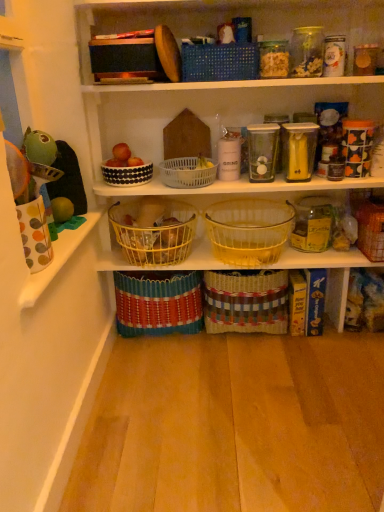
Question: From a real-world perspective, does white plastic basket at center, the 6th basket positioned from the bottom, stand above translucent glass basket at center, marked as the fourth basket in a top-to-bottom arrangement?

Choices:
 (A) yes
 (B) no

Answer: (A)

Question: Is white plastic basket at center, the 6th basket positioned from the bottom, closer to the viewer compared to translucent glass basket at center, which is counted as the fifth basket, starting from the bottom?

Choices:
 (A) yes
 (B) no

Answer: (B)

Question: Is translucent glass basket at center, marked as the fourth basket in a top-to-bottom arrangement, inside white plastic basket at center, the third basket from the top?

Choices:
 (A) yes
 (B) no

Answer: (B)

Question: Does white plastic basket at center, the third basket from the top, have a lesser height compared to translucent glass basket at center, which is counted as the fifth basket, starting from the bottom?

Choices:
 (A) yes
 (B) no

Answer: (A)

Question: Is translucent glass basket at center, marked as the fourth basket in a top-to-bottom arrangement, at the back of white plastic basket at center, the third basket from the top?

Choices:
 (A) yes
 (B) no

Answer: (B)

Question: From a real-world perspective, is translucent glass basket at center, marked as the fourth basket in a top-to-bottom arrangement, physically located above or below woven brown basket at lower right, placed as the 4th basket when sorted from bottom to top?

Choices:
 (A) below
 (B) above

Answer: (B)

Question: Looking at the image, does translucent glass basket at center, marked as the fourth basket in a top-to-bottom arrangement, seem bigger or smaller compared to woven brown basket at lower right, placed as the 4th basket when sorted from bottom to top?

Choices:
 (A) big
 (B) small

Answer: (A)

Question: From the image's perspective, is translucent glass basket at center, which is counted as the fifth basket, starting from the bottom, located above or below woven brown basket at lower right, placed as the 4th basket when sorted from bottom to top?

Choices:
 (A) below
 (B) above

Answer: (B)

Question: Does point (281, 221) appear closer or farther from the camera than point (375, 262)?

Choices:
 (A) farther
 (B) closer

Answer: (A)

Question: From the image's perspective, is woven brown basket at lower right, placed as the 4th basket when sorted from bottom to top, above or below woven fabric basket at center, positioned as the 8th basket in top-to-bottom order?

Choices:
 (A) above
 (B) below

Answer: (A)

Question: In terms of width, does woven brown basket at lower right, placed as the 4th basket when sorted from bottom to top, look wider or thinner when compared to woven fabric basket at center, positioned as the 8th basket in top-to-bottom order?

Choices:
 (A) wide
 (B) thin

Answer: (B)

Question: Is woven brown basket at lower right, marked as the fifth basket in a top-to-bottom arrangement, to the left or to the right of woven fabric basket at center, which is the first basket in bottom-to-top order, in the image?

Choices:
 (A) right
 (B) left

Answer: (A)

Question: Considering the positions of point (379, 247) and point (119, 297), is point (379, 247) closer or farther from the camera than point (119, 297)?

Choices:
 (A) closer
 (B) farther

Answer: (A)

Question: In the image, is white plastic basket at center, the third basket from the top, on the left side or the right side of woven fabric basket at center, positioned as the 8th basket in top-to-bottom order?

Choices:
 (A) left
 (B) right

Answer: (B)

Question: Based on their sizes in the image, would you say white plastic basket at center, the third basket from the top, is bigger or smaller than woven fabric basket at center, which is the first basket in bottom-to-top order?

Choices:
 (A) small
 (B) big

Answer: (A)